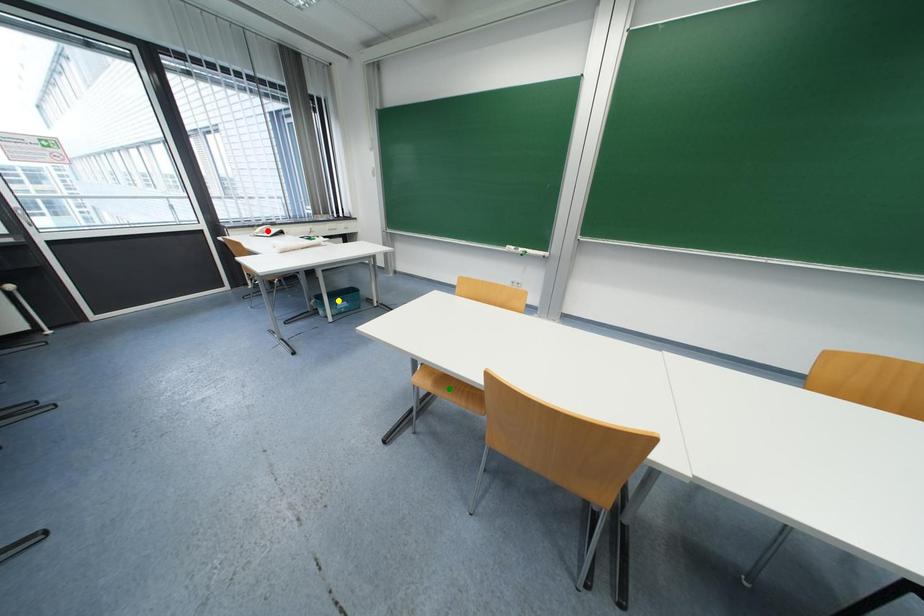
Order these from nearest to farthest:
red point
yellow point
green point

green point < red point < yellow point